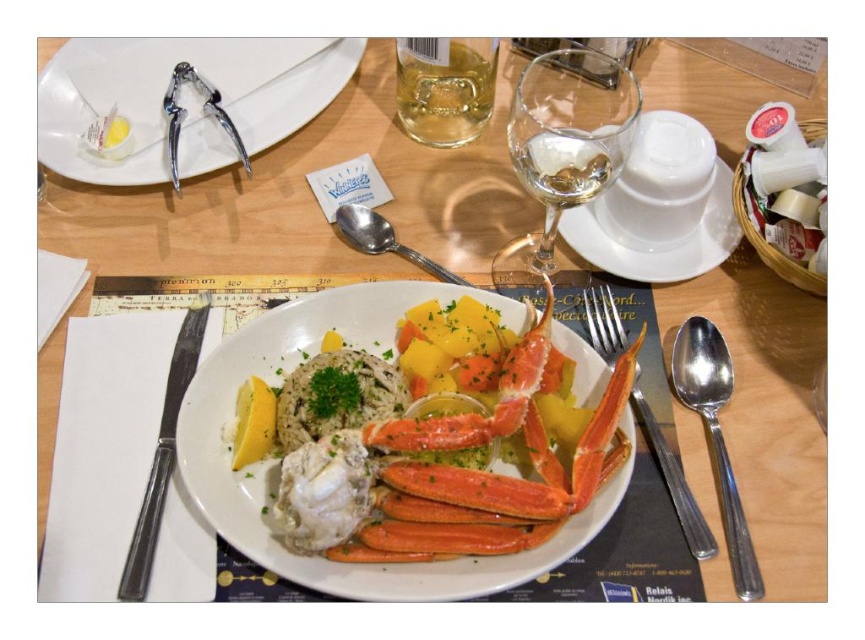
This screenshot has width=865, height=640. Find the location of `white creamy rice at center`. white creamy rice at center is located at coordinates (336, 396).

Between point (290, 397) and point (161, 451), which one is positioned behind?

The point (161, 451) is more distant.

Is point (385, 369) behind point (206, 314)?

No.

At what (x,y) coordinates should I click in order to perform the action: click on white creamy rice at center. Please return your answer as a coordinate pair (x, y). Looking at the image, I should click on (336, 396).

Which is more to the right, transparent glass wine glass at upper center or polished metal knife at left?

transparent glass wine glass at upper center

Can you confirm if transparent glass wine glass at upper center is shorter than polished metal knife at left?

Yes, transparent glass wine glass at upper center is shorter than polished metal knife at left.

The image size is (865, 640). Identify the location of transparent glass wine glass at upper center. (565, 144).

Locate an element on the screen. transparent glass wine glass at upper center is located at coordinates (565, 144).

Can you confirm if white creamy rice at center is thinner than clear glass wine at upper center?

Incorrect, white creamy rice at center's width is not less than clear glass wine at upper center's.

At what (x,y) coordinates should I click in order to perform the action: click on white creamy rice at center. Please return your answer as a coordinate pair (x, y). Image resolution: width=865 pixels, height=640 pixels. Looking at the image, I should click on pos(336,396).